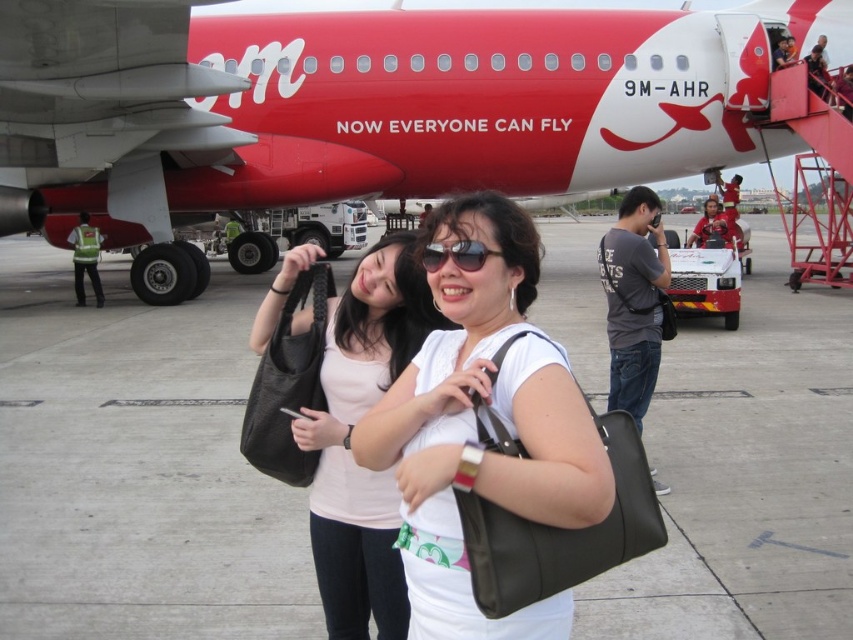
You are a photographer trying to capture the two women in the scene. The white matte shirt at center and the gray fabric camera bag at right are visible in your frame. Based on their sizes, which object should you focus on to ensure it takes up more space in the photo?

The white matte shirt at center might be wider than gray fabric camera bag at right, so focusing on the white matte shirt at center would likely result in it taking up more space in the photo.

You are a photographer standing at the camera position. You want to ensure the white matte shirt at center is in focus while capturing the airplane in the background. Since the shirt is 5.51 feet away from the camera, what should be the minimum focusing distance you set on your camera to achieve this?

The white matte shirt at center is 5.51 feet away from the camera. To ensure it is in focus, the minimum focusing distance should be set to at least 5.51 feet.

You are a photographer at the airport tarmac. You need to position your camera to capture both the white matte shirt at center and the gray fabric camera bag at right in the frame. Considering their heights, which object should be placed lower in the frame to ensure both are visible?

The gray fabric camera bag at right should be placed lower in the frame since the white matte shirt at center is taller, allowing both objects to be visible within the camera frame.